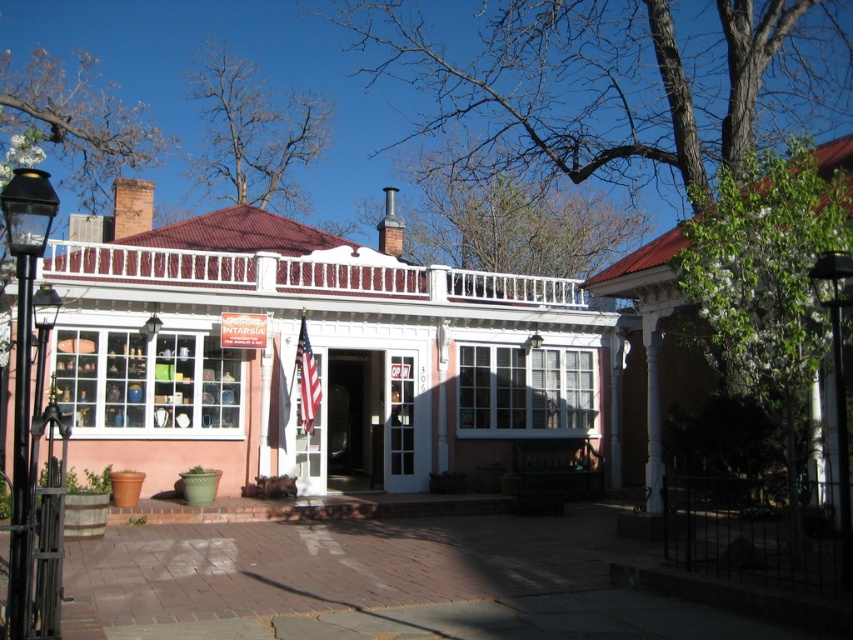
Question: Is black metal lamp post at left closer to the viewer compared to matte white door at center?

Choices:
 (A) yes
 (B) no

Answer: (A)

Question: Can you confirm if black metal lamp post at left is positioned to the right of matte white door at center?

Choices:
 (A) no
 (B) yes

Answer: (A)

Question: Which of the following is the closest to the observer?

Choices:
 (A) (12, 516)
 (B) (358, 384)

Answer: (A)

Question: Is white painted wood porch at center further to camera compared to black metal lamp post at left?

Choices:
 (A) no
 (B) yes

Answer: (B)

Question: Which is nearer to the matte white door at center?

Choices:
 (A) black metal lamp post at left
 (B) white painted wood porch at center

Answer: (B)

Question: Among these points, which one is nearest to the camera?

Choices:
 (A) (160, 275)
 (B) (16, 440)
 (C) (381, 365)

Answer: (B)